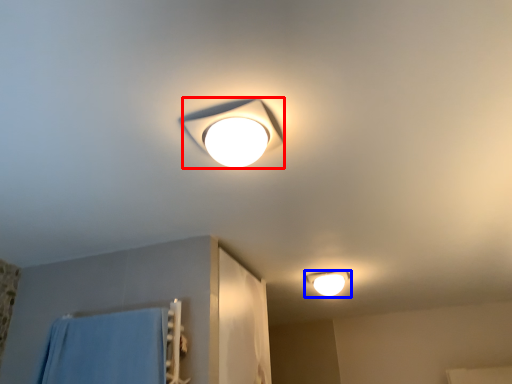
Question: Which of the following is the closest to the observer, lamp (highlighted by a red box) or lamp (highlighted by a blue box)?

Choices:
 (A) lamp
 (B) lamp

Answer: (A)